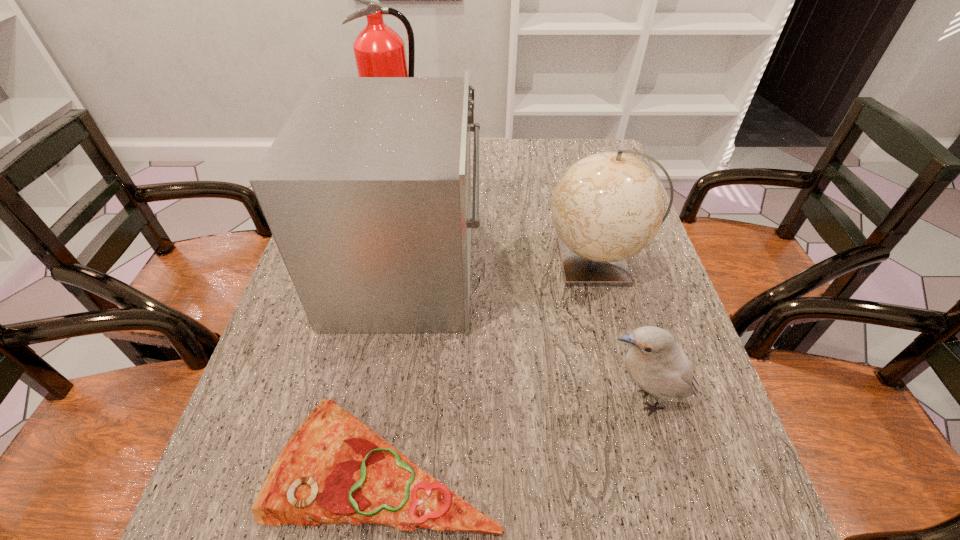
Locate an element on the screen. The width and height of the screenshot is (960, 540). bird at the right edge is located at coordinates (654, 361).

I want to click on object at the far left corner, so click(x=379, y=51).

I want to click on object that is at the near left corner, so click(334, 469).

At what (x,y) coordinates should I click in order to perform the action: click on vacant space at the far edge of the desktop. Please return your answer as a coordinate pair (x, y). The width and height of the screenshot is (960, 540). Looking at the image, I should click on (540, 177).

Where is `vacant space at the left edge of the desktop`? The width and height of the screenshot is (960, 540). vacant space at the left edge of the desktop is located at coordinates (345, 337).

Image resolution: width=960 pixels, height=540 pixels. I want to click on vacant area at the right edge, so click(x=737, y=508).

At what (x,y) coordinates should I click in order to perform the action: click on free space at the far right corner. Please return your answer as a coordinate pair (x, y). This screenshot has width=960, height=540. Looking at the image, I should click on (604, 151).

At what (x,y) coordinates should I click in order to perform the action: click on free space between the second tallest object and the second shortest object. Please return your answer as a coordinate pair (x, y). Looking at the image, I should click on (527, 335).

Identify the location of unoccupied area between the toaster oven and the third tallest object. (502, 266).

Where is `free space between the shortest object and the second shortest object`? free space between the shortest object and the second shortest object is located at coordinates (516, 431).